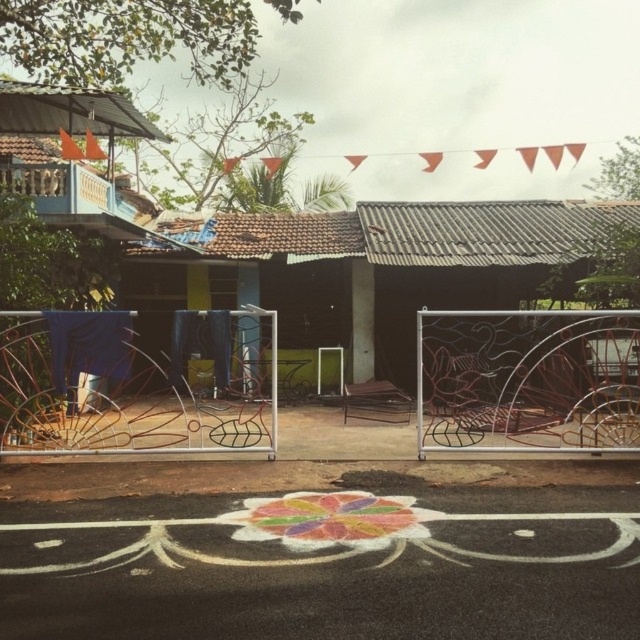
You are standing near the blue painted wood hut at left and want to walk towards the wooden chair at center. Which direction should you move to reach the chair?

Since the blue painted wood hut at left is closer to you than the wooden chair at center, you should move away from the hut towards the center of the scene to reach the wooden chair at center.

You are a visitor standing on the paved road with the colorful rangoli design. You want to take a photo of the wooden chair at center without the blue painted wood hut at left blocking the view. Is it possible to do so from your current position?

The blue painted wood hut at left is positioned over the wooden chair at center, so it would block the view. To take a photo of the wooden chair at center without the blue painted wood hut at left blocking the view, you would need to move to a position where the hut is not in front of the chair.

You are a delivery person trying to locate the correct delivery address. You see a brown corrugated metal hut at center and a blue painted wood hut at left. Which one is taller?

The brown corrugated metal hut at center is taller than the blue painted wood hut at left.